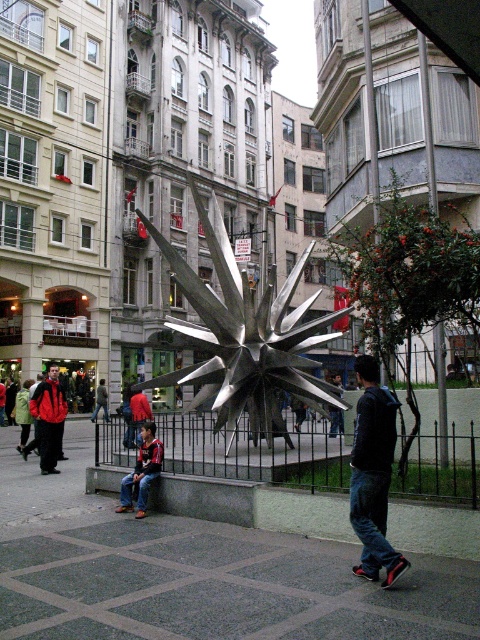
Question: Among these objects, which one is nearest to the camera?

Choices:
 (A) metallic starburst at center
 (B) red jacket at lower left
 (C) dark blue jeans at center

Answer: (C)

Question: Which of the following is the closest to the observer?

Choices:
 (A) (157, 230)
 (B) (370, 394)

Answer: (B)

Question: Which object is closer to the camera taking this photo?

Choices:
 (A) metallic starburst at center
 (B) dark blue jeans at center

Answer: (B)

Question: Can you confirm if gray concrete pavement at center is positioned above jeans at lower left?

Choices:
 (A) yes
 (B) no

Answer: (B)

Question: Can you confirm if metallic starburst at center is positioned below red jacket at lower left?

Choices:
 (A) no
 (B) yes

Answer: (A)

Question: Observing the image, what is the correct spatial positioning of gray concrete pavement at center in reference to red jacket at lower left?

Choices:
 (A) above
 (B) below

Answer: (A)